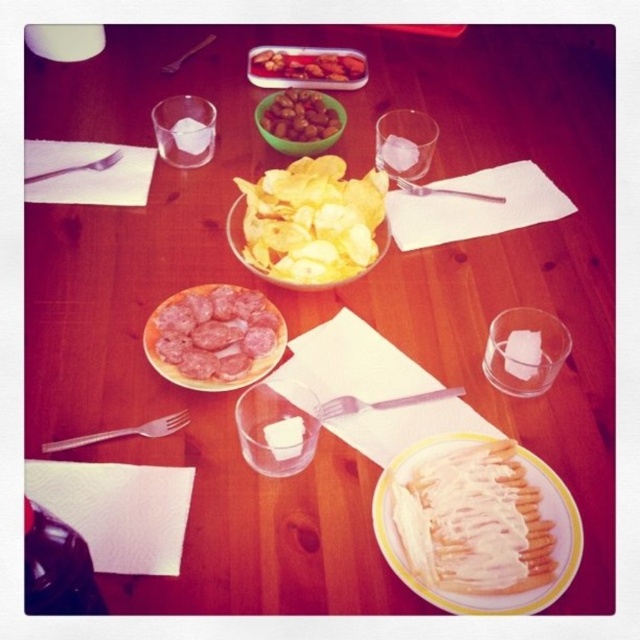
Question: Can you confirm if silver metallic fork at left is wider than matte silver fork at left?

Choices:
 (A) no
 (B) yes

Answer: (B)

Question: Is white creamy cheese sticks at center thinner than matte silver fork at left?

Choices:
 (A) no
 (B) yes

Answer: (A)

Question: Which point is farther to the camera?

Choices:
 (A) matte silver fork at left
 (B) brushed metal fork at upper left
 (C) yellow crispy chips at center
 (D) white creamy cheese sticks at center

Answer: (B)

Question: Can you confirm if sliced salami at center is positioned to the right of brushed metal fork at upper left?

Choices:
 (A) no
 (B) yes

Answer: (B)

Question: Among these objects, which one is farthest from the camera?

Choices:
 (A) silver metallic fork at upper center
 (B) white creamy cheese sticks at center
 (C) silver metallic fork at left

Answer: (A)

Question: Which is nearer to the white creamy cheese sticks at center?

Choices:
 (A) shiny brown nuts at center
 (B) pink plastic fork at center
 (C) brushed metal fork at upper left

Answer: (B)